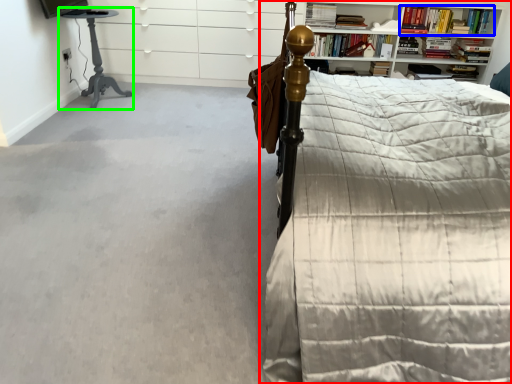
Question: Which object is positioned closest to bed (highlighted by a red box)? Select from book (highlighted by a blue box) and table (highlighted by a green box).

Choices:
 (A) book
 (B) table

Answer: (B)